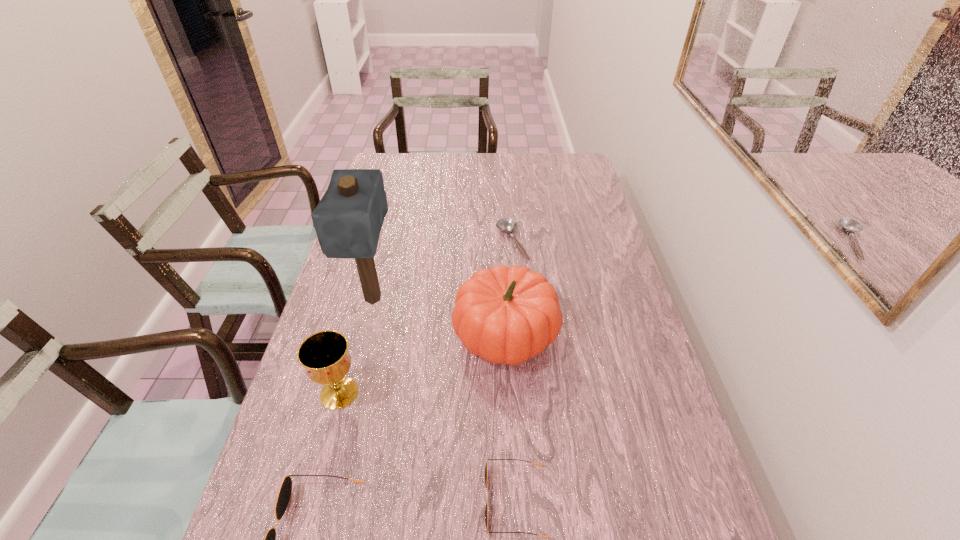
In the current image, all sunglassess are evenly spaced. To maintain this equal spacing, where should an additional sunglasses be placed on the right? Please point out a free spot. Please provide its 2D coordinates. Your answer should be formatted as a tuple, i.e. [(x, y)], where the tuple contains the x and y coordinates of a point satisfying the conditions above.

[(696, 474)]